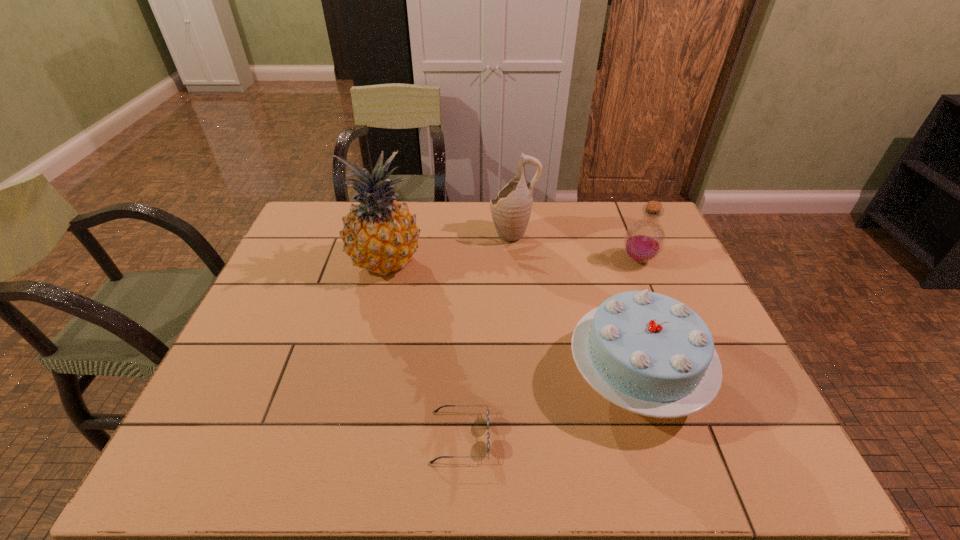
Identify the location of the tallest object. (380, 235).

The height and width of the screenshot is (540, 960). Identify the location of pineapple. (380, 235).

At what (x,y) coordinates should I click in order to perform the action: click on pitcher. Please return your answer as a coordinate pair (x, y). The image size is (960, 540). Looking at the image, I should click on (511, 209).

You are a GUI agent. You are given a task and a screenshot of the screen. Output one action in this format:
    pyautogui.click(x=<x>, y=<y>)
    Task: Click on the second tallest object
    Image resolution: width=960 pixels, height=540 pixels.
    Given the screenshot: What is the action you would take?
    pyautogui.click(x=511, y=209)

Where is `bottle`? The height and width of the screenshot is (540, 960). bottle is located at coordinates (644, 240).

Image resolution: width=960 pixels, height=540 pixels. I want to click on birthday cake, so click(x=648, y=353).

I want to click on the shortest object, so click(x=488, y=434).

What are the coordinates of `the second object from left to right` in the screenshot? It's located at (488, 434).

The width and height of the screenshot is (960, 540). In order to click on vacant space situated on the front of the leftmost object in this screenshot , I will do `click(370, 326)`.

This screenshot has width=960, height=540. What are the coordinates of `vacant region located 0.340m at the spout of the third object from left to right` in the screenshot? It's located at (387, 234).